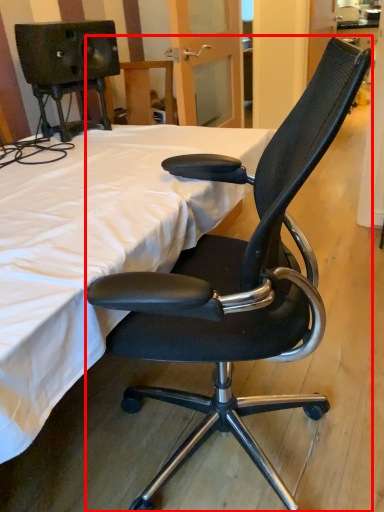
Question: In this image, where is chair (annotated by the red box) located relative to bed?

Choices:
 (A) right
 (B) left

Answer: (A)